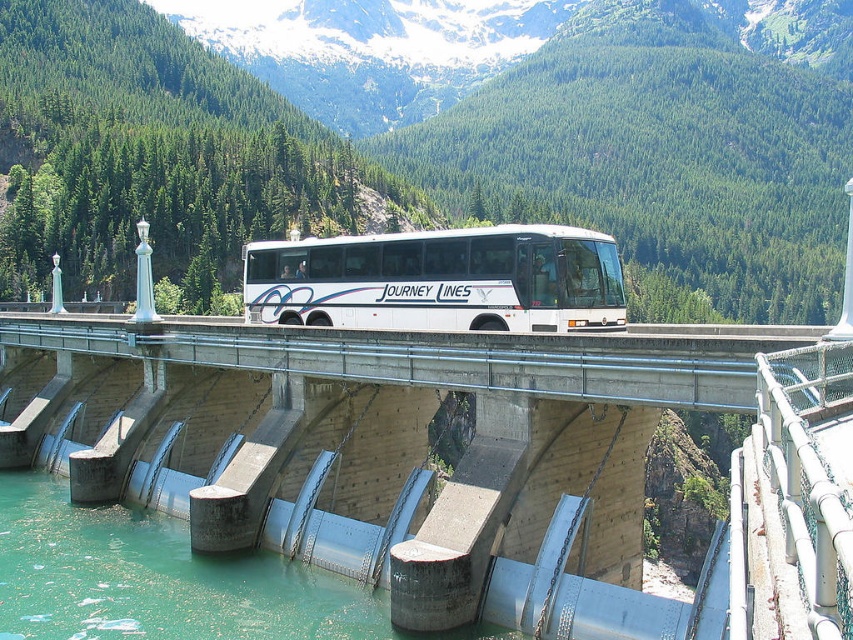
Does green concrete water at lower left have a smaller size compared to white matte bus at center?

Yes.

Is green concrete water at lower left shorter than white matte bus at center?

Indeed, green concrete water at lower left has a lesser height compared to white matte bus at center.

Which is behind, point (288, 561) or point (433, 262)?

The point (433, 262) is more distant.

Where is `green concrete water at lower left`? This screenshot has height=640, width=853. green concrete water at lower left is located at coordinates (163, 580).

Does concrete bridge at center lie behind white matte bus at center?

No, it is not.

Who is more forward, (373, 339) or (608, 252)?

Positioned in front is point (608, 252).

Where is `concrete bridge at center`? concrete bridge at center is located at coordinates (457, 461).

The image size is (853, 640). I want to click on concrete bridge at center, so click(457, 461).

Does green forested mountain at upper center appear on the right side of white matte bus at center?

Indeed, green forested mountain at upper center is positioned on the right side of white matte bus at center.

Which is behind, point (306, 129) or point (245, 308)?

The point (306, 129) is behind.

Is point (764, 141) farther from camera compared to point (334, 260)?

Yes, point (764, 141) is behind point (334, 260).

Find the location of `green forested mountain at upper center`. green forested mountain at upper center is located at coordinates (439, 154).